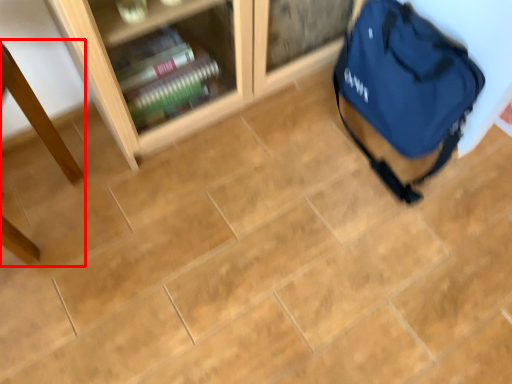
Question: From the image's perspective, what is the correct spatial positioning of table (annotated by the red box) in reference to backpack?

Choices:
 (A) above
 (B) below

Answer: (B)